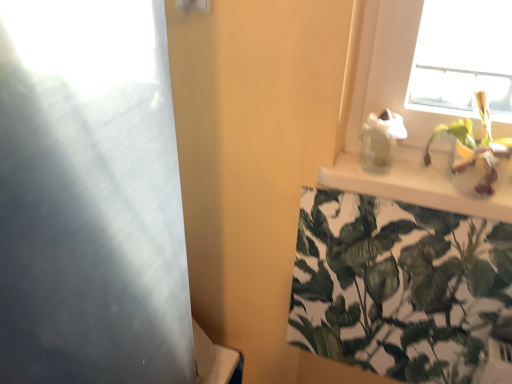
Question: Is white glossy shelf at upper right beside green leafy plant at upper right, the second houseplant when ordered from top to bottom?

Choices:
 (A) yes
 (B) no

Answer: (B)

Question: Does white glossy shelf at upper right have a greater width compared to green leafy plant at upper right, the 1th houseplant positioned from the bottom?

Choices:
 (A) no
 (B) yes

Answer: (B)

Question: Is green leafy plant at upper right, the 1th houseplant positioned from the bottom, at the back of white glossy shelf at upper right?

Choices:
 (A) yes
 (B) no

Answer: (B)

Question: Considering the relative sizes of white glossy shelf at upper right and green leafy plant at upper right, the 1th houseplant positioned from the bottom, in the image provided, is white glossy shelf at upper right taller than green leafy plant at upper right, the 1th houseplant positioned from the bottom,?

Choices:
 (A) no
 (B) yes

Answer: (A)

Question: From the image's perspective, would you say white glossy shelf at upper right is positioned over green leafy plant at upper right, the 1th houseplant positioned from the bottom?

Choices:
 (A) no
 (B) yes

Answer: (B)

Question: Looking at their shapes, would you say green leafy plant at upper right, the second houseplant when ordered from top to bottom, is wider or thinner than green leafy plant at upper right, arranged as the first houseplant when viewed from the top?

Choices:
 (A) thin
 (B) wide

Answer: (A)

Question: In terms of height, does green leafy plant at upper right, the second houseplant when ordered from top to bottom, look taller or shorter compared to green leafy plant at upper right, arranged as the first houseplant when viewed from the top?

Choices:
 (A) short
 (B) tall

Answer: (B)

Question: From the image's perspective, is green leafy plant at upper right, the second houseplant when ordered from top to bottom, above or below green leafy plant at upper right, arranged as the first houseplant when viewed from the top?

Choices:
 (A) above
 (B) below

Answer: (B)

Question: Choose the correct answer: Is green leafy plant at upper right, the second houseplant when ordered from top to bottom, inside green leafy plant at upper right, arranged as the first houseplant when viewed from the top, or outside it?

Choices:
 (A) inside
 (B) outside

Answer: (B)

Question: Is green leafy plant at upper right, arranged as the first houseplant when viewed from the top, in front of or behind white glossy shelf at upper right in the image?

Choices:
 (A) front
 (B) behind

Answer: (A)

Question: Based on their sizes in the image, would you say green leafy plant at upper right, arranged as the first houseplant when viewed from the top, is bigger or smaller than white glossy shelf at upper right?

Choices:
 (A) big
 (B) small

Answer: (A)

Question: From the image's perspective, is green leafy plant at upper right, which is counted as the 2th houseplant, starting from the bottom, positioned above or below white glossy shelf at upper right?

Choices:
 (A) above
 (B) below

Answer: (A)

Question: From a real-world perspective, is green leafy plant at upper right, which is counted as the 2th houseplant, starting from the bottom, positioned above or below white glossy shelf at upper right?

Choices:
 (A) above
 (B) below

Answer: (A)

Question: Is transparent glass screen door at left bigger or smaller than green leafy plant at upper right, arranged as the first houseplant when viewed from the top?

Choices:
 (A) big
 (B) small

Answer: (A)

Question: Considering the relative positions of transparent glass screen door at left and green leafy plant at upper right, which is counted as the 2th houseplant, starting from the bottom, in the image provided, is transparent glass screen door at left to the left or to the right of green leafy plant at upper right, which is counted as the 2th houseplant, starting from the bottom,?

Choices:
 (A) right
 (B) left

Answer: (B)